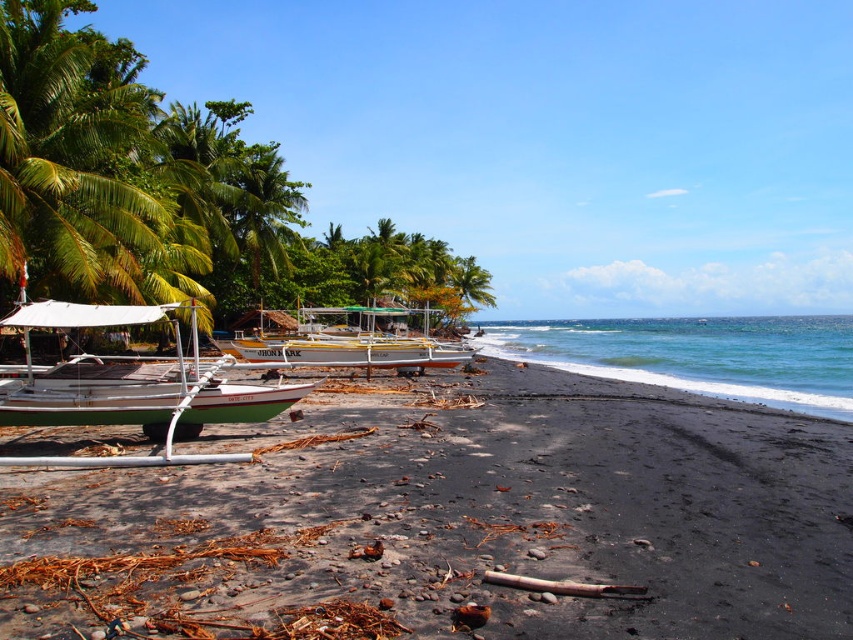
You are a tourist standing on the beach and want to take a photo of both the green matte boat at left and the white wood boat at center. Which boat should you stand closer to in order to include both in your camera frame?

You should stand closer to the green matte boat at left because it is positioned on the left side of the white wood boat at center, so moving closer to it would help capture both boats within the frame.